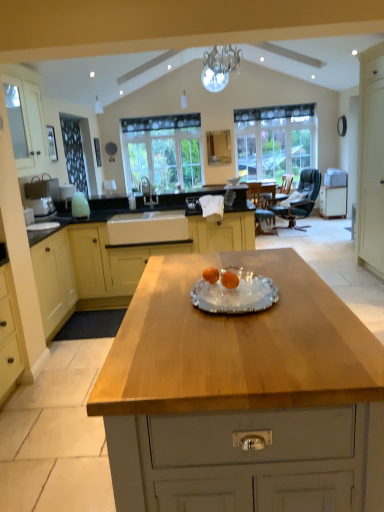
Question: Should I look upward or downward to see dark green leather chair at right?

Choices:
 (A) down
 (B) up

Answer: (B)

Question: Is the position of light wood/texture cabinet at center, the third cabinetry from the front, more distant than that of white wood door at right, the 3th cabinetry from the back?

Choices:
 (A) yes
 (B) no

Answer: (A)

Question: From a real-world perspective, is light wood/texture cabinet at center, which is the 2th cabinetry from back to front, on white wood door at right, positioned as the third cabinetry in left-to-right order?

Choices:
 (A) yes
 (B) no

Answer: (B)

Question: Is light wood/texture cabinet at center, the third cabinetry from the front, outside white wood door at right, which ranks as the second cabinetry in front-to-back order?

Choices:
 (A) yes
 (B) no

Answer: (A)

Question: Is light wood/texture cabinet at center, which is the 2th cabinetry from back to front, to the right of white wood door at right, which ranks as the second cabinetry in front-to-back order, from the viewer's perspective?

Choices:
 (A) no
 (B) yes

Answer: (A)

Question: Can you confirm if light wood/texture cabinet at center, which is the 2th cabinetry from back to front, is thinner than white wood door at right, the second cabinetry viewed from the right?

Choices:
 (A) yes
 (B) no

Answer: (B)

Question: Is light wood/texture cabinet at center, which is the 2th cabinetry from back to front, facing towards white wood door at right, the second cabinetry viewed from the right?

Choices:
 (A) yes
 (B) no

Answer: (B)

Question: From a real-world perspective, is white glossy sink at center positioned under clear glass window at center, the 1th window when ordered from left to right, based on gravity?

Choices:
 (A) yes
 (B) no

Answer: (A)

Question: Is white glossy sink at center at the left side of clear glass window at center, acting as the 2th window starting from the right?

Choices:
 (A) yes
 (B) no

Answer: (B)

Question: Is clear glass window at center, the 1th window when ordered from left to right, surrounded by white glossy sink at center?

Choices:
 (A) yes
 (B) no

Answer: (B)

Question: Is the depth of white glossy sink at center less than that of clear glass window at center, acting as the 2th window starting from the right?

Choices:
 (A) no
 (B) yes

Answer: (B)

Question: Is white glossy sink at center far from clear glass window at center, acting as the 2th window starting from the right?

Choices:
 (A) yes
 (B) no

Answer: (A)

Question: Is white glossy sink at center bigger than clear glass window at center, the 1th window when ordered from left to right?

Choices:
 (A) no
 (B) yes

Answer: (A)

Question: Does wooden table at center contain clear glass window at center, acting as the 2th window starting from the right?

Choices:
 (A) no
 (B) yes

Answer: (A)